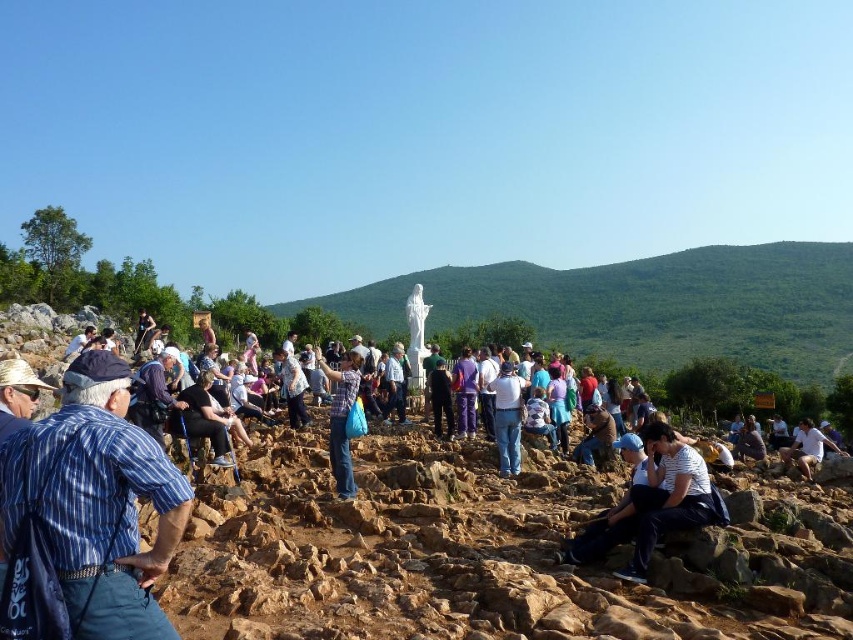
Question: Can you confirm if blue striped shirt at center is positioned below white cotton shirt at center?

Choices:
 (A) yes
 (B) no

Answer: (B)

Question: Observing the image, what is the correct spatial positioning of white marble statue at center in reference to blue striped shirt at center?

Choices:
 (A) below
 (B) above

Answer: (B)

Question: Does plaid shirt at center come behind white cotton shirt at center?

Choices:
 (A) no
 (B) yes

Answer: (A)

Question: Among these objects, which one is nearest to the camera?

Choices:
 (A) blue striped shirt at center
 (B) striped cotton shirt at lower right
 (C) white cotton shirt at center
 (D) white marble statue at center

Answer: (A)

Question: Which point is closer to the camera taking this photo?

Choices:
 (A) (811, 454)
 (B) (515, 442)
 (C) (664, 428)
 (D) (38, 632)

Answer: (D)

Question: Which object appears closest to the camera in this image?

Choices:
 (A) plaid shirt at center
 (B) blue striped shirt at center
 (C) striped cotton shirt at lower right

Answer: (B)